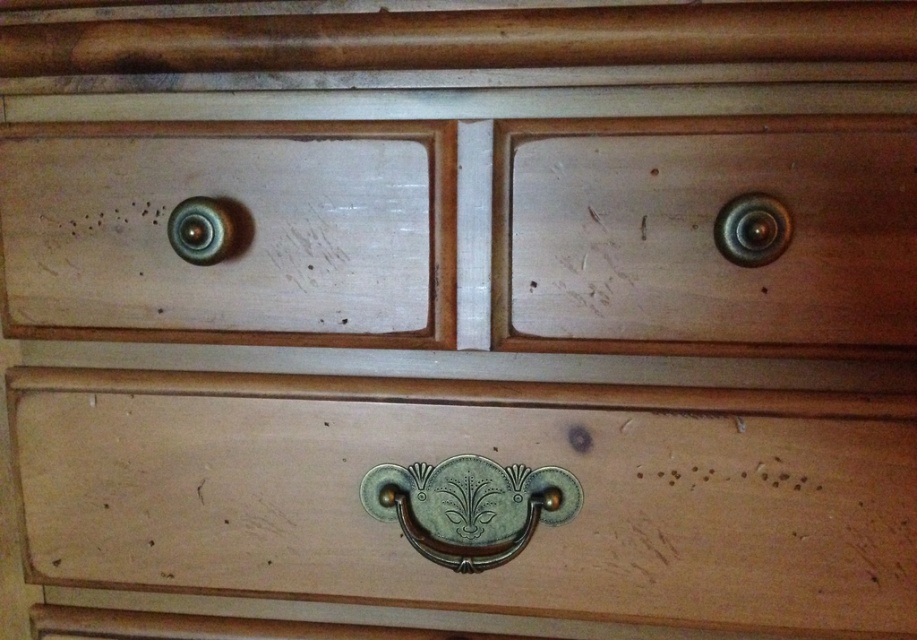
Looking at the wooden furniture with three drawers, you notice the matte wood drawer at left and the metallic gold knob at upper right. Which of these two items is positioned more to the left side of the furniture?

The matte wood drawer at left is positioned more to the left side of the furniture than the metallic gold knob at upper right.

Consider the image. Looking at the wooden furniture with three drawers, you notice the matte wood drawer at bottom and the matte wood drawer at left. Which drawer has a taller height?

The matte wood drawer at bottom has a greater height compared to the matte wood drawer at left.